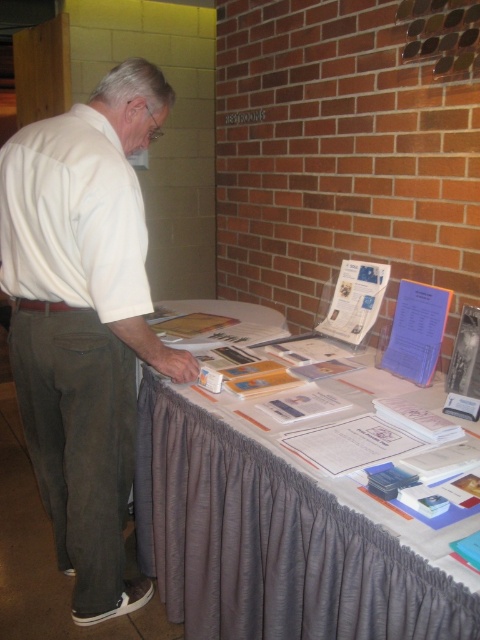
You are a photographer taking a picture of the scene from the front. You want to focus on both point (86, 172) and point (106, 204). Which point should you focus on first to ensure both are in focus?

You should focus on point (86, 172) first because it is closer to the viewer than point (106, 204). By focusing on the closer point, the depth of field may include the farther point as well, ensuring both are in focus.

You are a photographer taking a picture of the scene. The gray fabric tablecloth at lower center and the white cotton shirt at left are both in the frame. Which object is closer to the camera?

The gray fabric tablecloth at lower center has a lesser height compared to the white cotton shirt at left, so the tablecloth is closer to the camera because it appears lower in the frame.

You are a person with a height of 5 feet 10 inches. You are standing at the table and want to reach the point at point (469, 582). Can you reach it?

The distance between you and the point is 35.41 inches, which is within the typical reaching range for a person of your height. Yes, you can reach it.